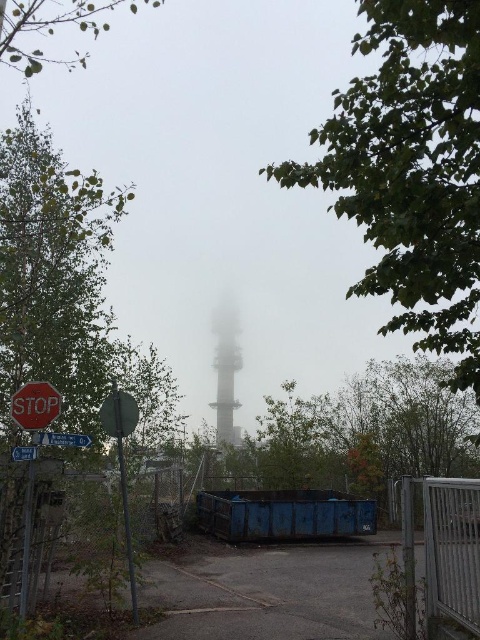
You are standing at the point closest to the stop sign in the scene. You want to walk straight ahead. Will you first encounter the point at (x=4, y=186) or the point at (x=32, y=420)?

You will first encounter the point at (x=32, y=420) because it is in front of the point at (x=4, y=186).

From the picture: You are driving a car and see the smooth gray tower at center and the red matte stop sign at lower left. Which object is closer to you?

The smooth gray tower at center is closer because the red matte stop sign at lower left is behind it.